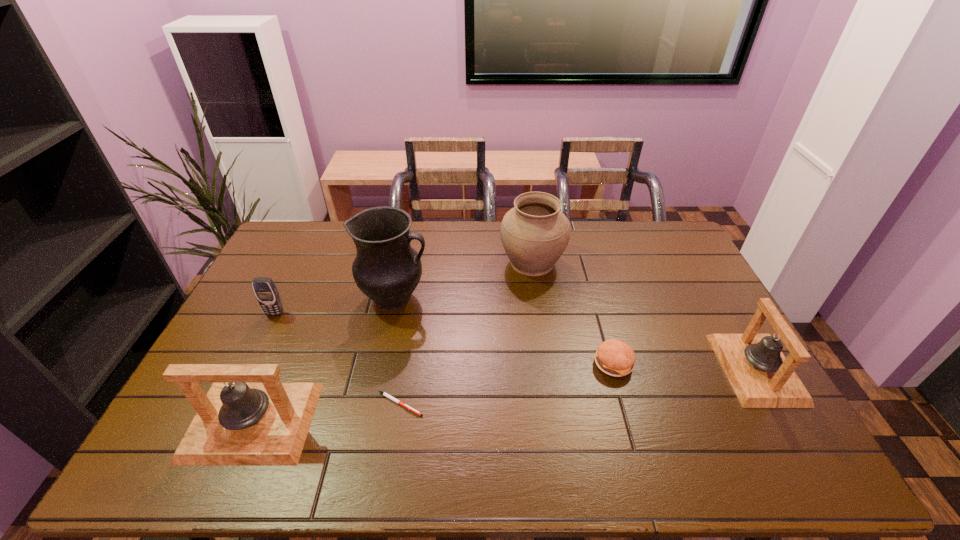
This screenshot has height=540, width=960. What are the coordinates of `the taller bell` in the screenshot? It's located at (237, 424).

The width and height of the screenshot is (960, 540). I want to click on the third tallest object, so click(237, 424).

The width and height of the screenshot is (960, 540). I want to click on the rightmost object, so click(x=761, y=376).

Image resolution: width=960 pixels, height=540 pixels. In order to click on the shorter bell in this screenshot , I will do `click(761, 376)`.

In order to click on pitcher in this screenshot , I will do pos(386,269).

Where is `the fifth object from left to right`? the fifth object from left to right is located at coordinates (534, 233).

This screenshot has width=960, height=540. I want to click on cellular telephone, so click(264, 288).

Identify the location of pen. This screenshot has height=540, width=960. (385, 394).

Find the location of a particular element. Image resolution: width=960 pixels, height=540 pixels. the second object from right to left is located at coordinates (614, 357).

At what (x,y) coordinates should I click in order to perform the action: click on the second shortest object. Please return your answer as a coordinate pair (x, y). Looking at the image, I should click on (614, 357).